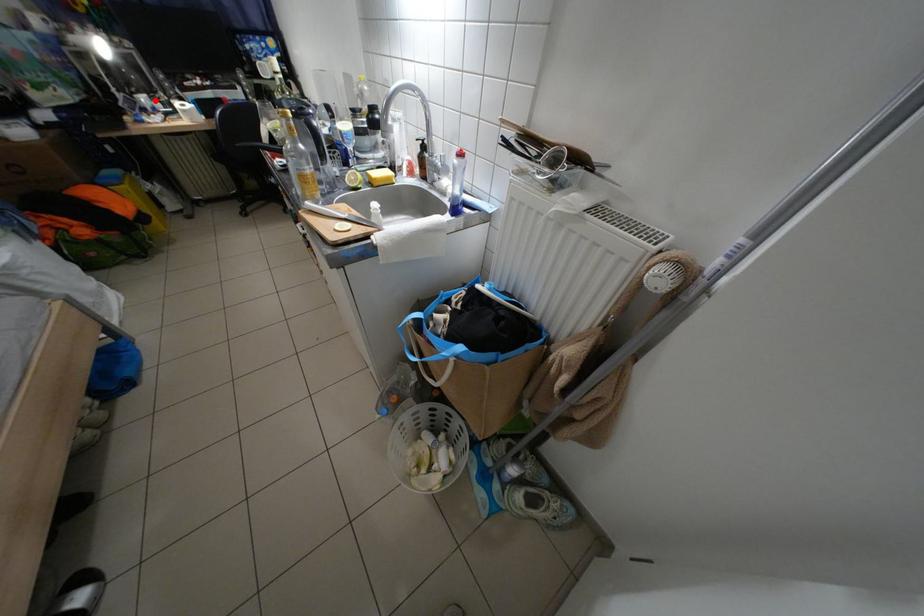
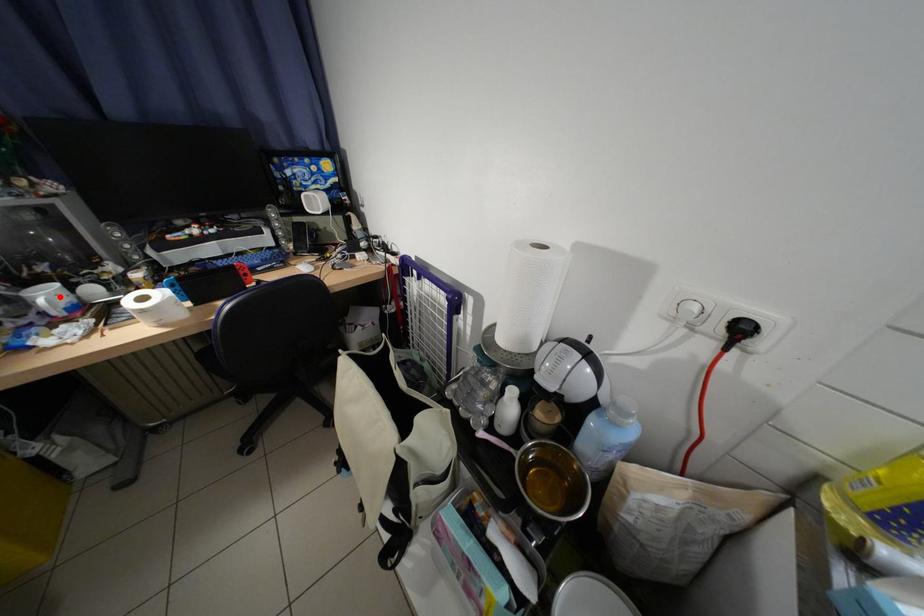
I am providing you with two images of the same scene from different viewpoints. A red point is marked on the first image and another point is marked on the second image. Is the red point in image1 aligned with the point shown in image2?

Yes